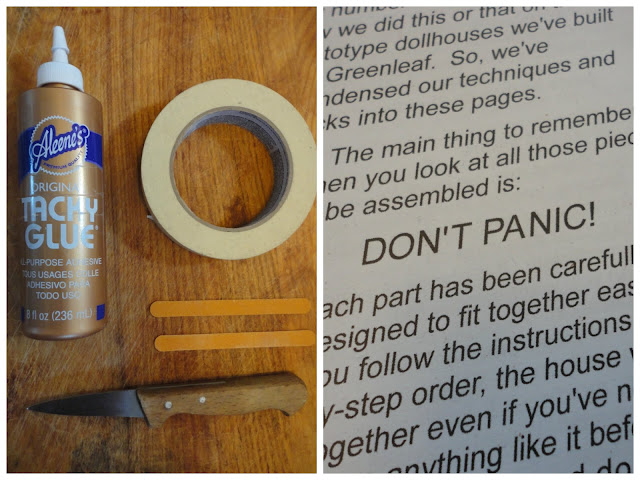
This screenshot has width=640, height=480. I want to click on wooden table, so click(173, 284).